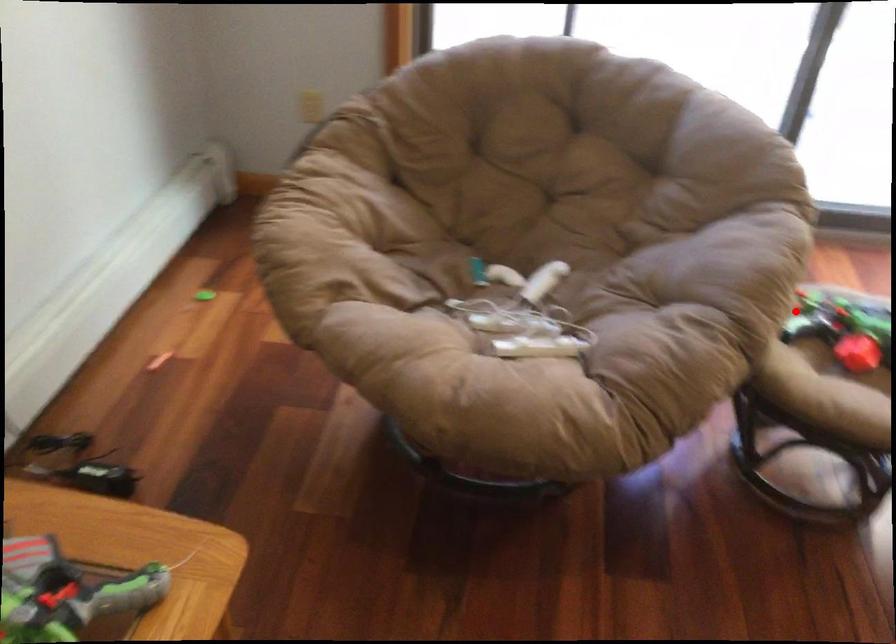
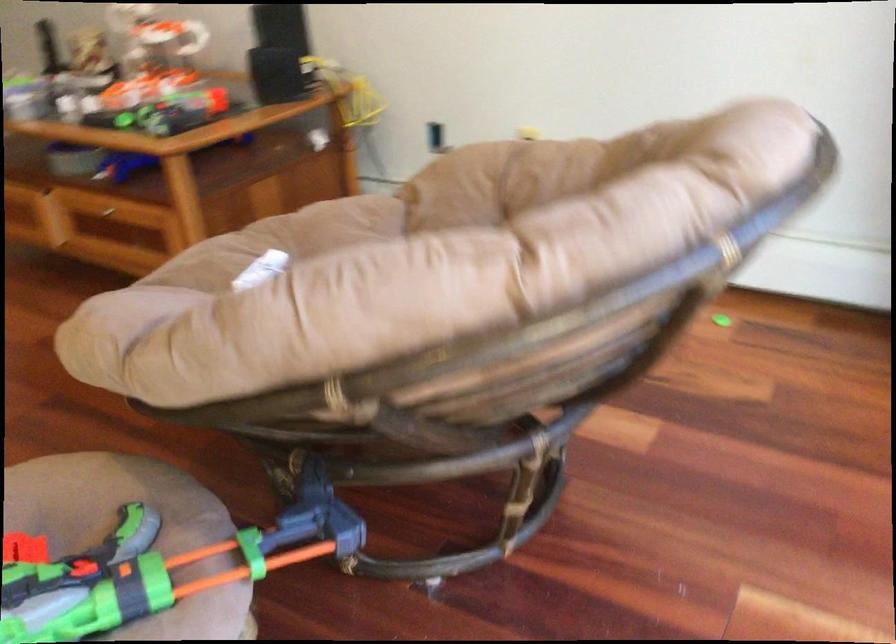
Locate, in the second image, the point that corresponds to the highlighted location in the first image.

(134, 527)